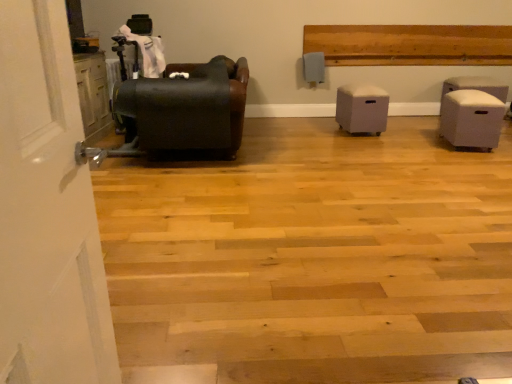
Question: Is white fabric ottoman at right, marked as the 3th furniture in a left-to-right arrangement, at the left side of light gray fabric ottoman at center, which is the second furniture in left-to-right order?

Choices:
 (A) no
 (B) yes

Answer: (A)

Question: Is white fabric ottoman at right, marked as the 3th furniture in a left-to-right arrangement, shorter than light gray fabric ottoman at center, which is the 2th furniture in right-to-left order?

Choices:
 (A) no
 (B) yes

Answer: (A)

Question: Is white fabric ottoman at right, the first furniture in the right-to-left sequence, in contact with light gray fabric ottoman at center, which is the 2th furniture in right-to-left order?

Choices:
 (A) yes
 (B) no

Answer: (B)

Question: From a real-world perspective, does white fabric ottoman at right, the first furniture in the right-to-left sequence, sit lower than light gray fabric ottoman at center, which is the second furniture in left-to-right order?

Choices:
 (A) yes
 (B) no

Answer: (A)

Question: Can you confirm if white fabric ottoman at right, marked as the 3th furniture in a left-to-right arrangement, is thinner than light gray fabric ottoman at center, which is the 2th furniture in right-to-left order?

Choices:
 (A) no
 (B) yes

Answer: (B)

Question: Is matte black leather armchair at left, arranged as the first furniture when viewed from the left, in front of or behind white fabric ottoman at right, marked as the 3th furniture in a left-to-right arrangement, in the image?

Choices:
 (A) front
 (B) behind

Answer: (A)

Question: Would you say matte black leather armchair at left, arranged as the first furniture when viewed from the left, is to the left or to the right of white fabric ottoman at right, marked as the 3th furniture in a left-to-right arrangement, in the picture?

Choices:
 (A) left
 (B) right

Answer: (A)

Question: Considering the positions of matte black leather armchair at left, arranged as the first furniture when viewed from the left, and white fabric ottoman at right, the first furniture in the right-to-left sequence, in the image, is matte black leather armchair at left, arranged as the first furniture when viewed from the left, bigger or smaller than white fabric ottoman at right, the first furniture in the right-to-left sequence,?

Choices:
 (A) small
 (B) big

Answer: (B)

Question: Is point (231, 84) positioned closer to the camera than point (455, 125)?

Choices:
 (A) farther
 (B) closer

Answer: (B)

Question: Considering the positions of point (473, 102) and point (194, 115), is point (473, 102) closer or farther from the camera than point (194, 115)?

Choices:
 (A) farther
 (B) closer

Answer: (A)

Question: In terms of size, does white fabric ottoman at right, marked as the 3th furniture in a left-to-right arrangement, appear bigger or smaller than matte black leather armchair at left, placed as the 3th furniture when sorted from right to left?

Choices:
 (A) big
 (B) small

Answer: (B)

Question: From a real-world perspective, relative to matte black leather armchair at left, arranged as the first furniture when viewed from the left, is white fabric ottoman at right, the first furniture in the right-to-left sequence, vertically above or below?

Choices:
 (A) above
 (B) below

Answer: (B)

Question: Considering the positions of white fabric ottoman at right, marked as the 3th furniture in a left-to-right arrangement, and matte black leather armchair at left, arranged as the first furniture when viewed from the left, in the image, is white fabric ottoman at right, marked as the 3th furniture in a left-to-right arrangement, taller or shorter than matte black leather armchair at left, arranged as the first furniture when viewed from the left,?

Choices:
 (A) tall
 (B) short

Answer: (B)

Question: Considering the positions of light gray fabric ottoman at center, which is the 2th furniture in right-to-left order, and white fabric ottoman at right, the first furniture in the right-to-left sequence, in the image, is light gray fabric ottoman at center, which is the 2th furniture in right-to-left order, bigger or smaller than white fabric ottoman at right, the first furniture in the right-to-left sequence,?

Choices:
 (A) big
 (B) small

Answer: (B)

Question: Is light gray fabric ottoman at center, which is the second furniture in left-to-right order, in front of or behind white fabric ottoman at right, marked as the 3th furniture in a left-to-right arrangement, in the image?

Choices:
 (A) behind
 (B) front

Answer: (A)